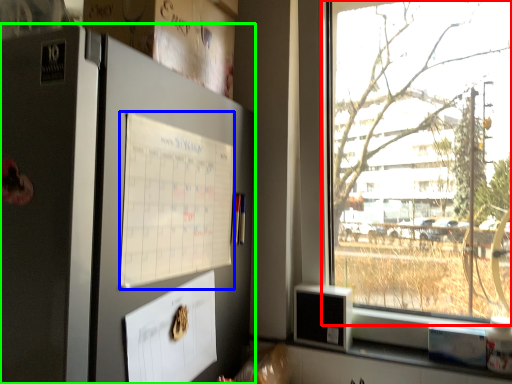
Question: Which object is positioned farthest from window (highlighted by a red box)? Select from poster (highlighted by a blue box) and fridge (highlighted by a green box).

Choices:
 (A) poster
 (B) fridge

Answer: (B)